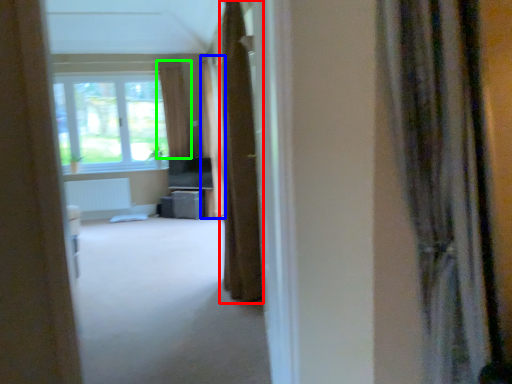
Question: Estimate the real-world distances between objects in this image. Which object is closer to curtain (highlighted by a red box), curtain (highlighted by a blue box) or curtain (highlighted by a green box)?

Choices:
 (A) curtain
 (B) curtain

Answer: (A)